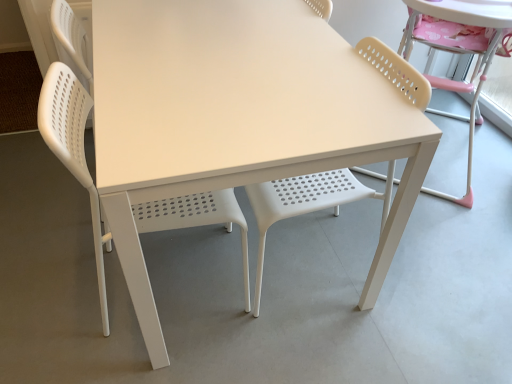
Question: From the image's perspective, relative to white plastic chair at left, arranged as the 3th chair when viewed from the right, is matte white chair at center, placed as the second chair when sorted from right to left, above or below?

Choices:
 (A) below
 (B) above

Answer: (B)

Question: From their relative heights in the image, would you say matte white chair at center, which ranks as the 2th chair in left-to-right order, is taller or shorter than white plastic chair at left, which ranks as the 1th chair in left-to-right order?

Choices:
 (A) tall
 (B) short

Answer: (B)

Question: Based on their relative distances, which object is nearer to the white plastic table at center?

Choices:
 (A) matte white chair at center, which ranks as the 2th chair in left-to-right order
 (B) white plastic chair at left, which ranks as the 1th chair in left-to-right order
 (C) beige perforated chair at right, placed as the 3th chair when sorted from left to right

Answer: (B)

Question: Considering the real-world distances, which object is farthest from the matte white chair at center, placed as the second chair when sorted from right to left?

Choices:
 (A) beige perforated chair at right, placed as the 3th chair when sorted from left to right
 (B) white plastic chair at left, arranged as the 3th chair when viewed from the right
 (C) white plastic table at center

Answer: (A)